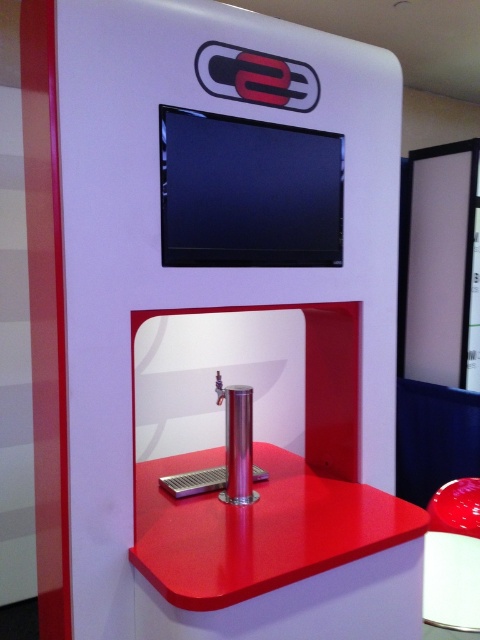
Question: Does shiny red table at center appear over glossy plastic stool at lower right?

Choices:
 (A) no
 (B) yes

Answer: (B)

Question: Among these objects, which one is farthest from the camera?

Choices:
 (A) shiny red table at center
 (B) glossy plastic stool at lower right

Answer: (B)

Question: Does shiny red table at center appear on the right side of glossy plastic stool at lower right?

Choices:
 (A) no
 (B) yes

Answer: (A)

Question: Observing the image, what is the correct spatial positioning of shiny red table at center in reference to glossy plastic stool at lower right?

Choices:
 (A) below
 (B) above

Answer: (B)